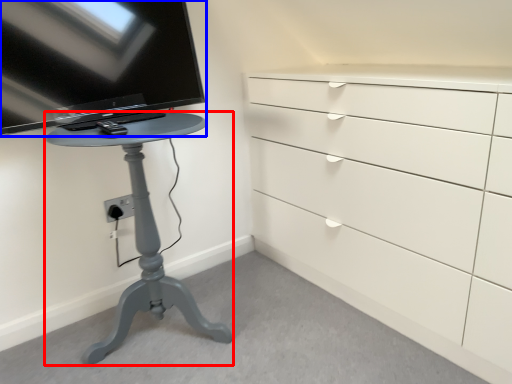
Question: Which of the following is the farthest to the observer, furniture (highlighted by a red box) or television (highlighted by a blue box)?

Choices:
 (A) furniture
 (B) television

Answer: (B)